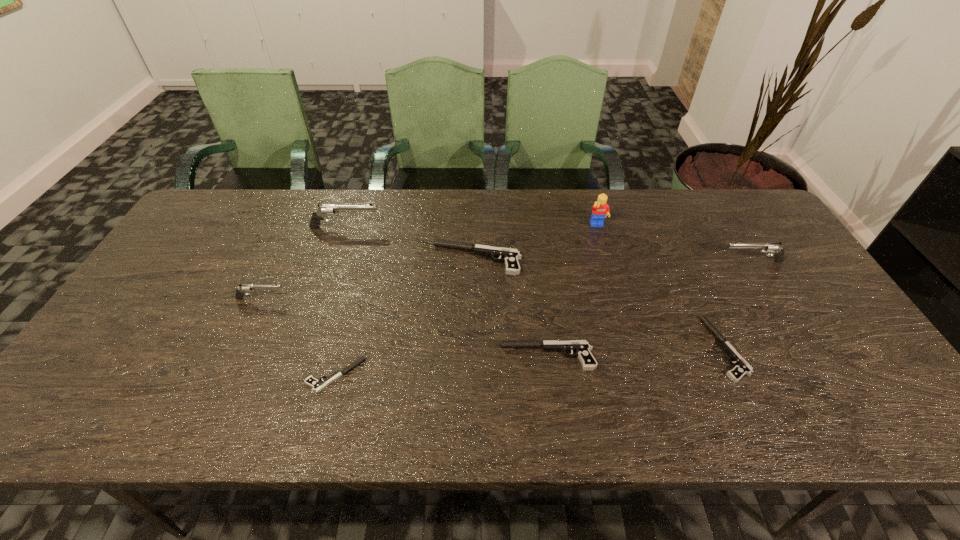
Image resolution: width=960 pixels, height=540 pixels. I want to click on free space located 0.250m on the front-facing side of the third tallest object, so click(636, 261).

Image resolution: width=960 pixels, height=540 pixels. Find the location of `free space located 0.200m on the front-facing side of the nearest silver pistol`. free space located 0.200m on the front-facing side of the nearest silver pistol is located at coordinates (361, 299).

At what (x,y) coordinates should I click in order to perform the action: click on free space located on the front-facing side of the fourth shortest pistol. Please return your answer as a coordinate pair (x, y). Looking at the image, I should click on (381, 259).

The width and height of the screenshot is (960, 540). Find the location of `free space located 0.150m on the front-facing side of the fourth shortest pistol`. free space located 0.150m on the front-facing side of the fourth shortest pistol is located at coordinates (381, 259).

I want to click on vacant space located on the front-facing side of the fourth shortest pistol, so click(297, 259).

Find the location of `vacant region located on the front-facing side of the third shortest object`. vacant region located on the front-facing side of the third shortest object is located at coordinates (388, 356).

At what (x,y) coordinates should I click in order to perform the action: click on free space located on the front-facing side of the third shortest object. Please return your answer as a coordinate pair (x, y). Looking at the image, I should click on [x=392, y=356].

The image size is (960, 540). I want to click on vacant area situated 0.060m on the front-facing side of the third shortest object, so click(x=475, y=356).

Identify the location of free space located 0.050m on the front-facing side of the second pistol from right to left. (691, 349).

You are a GUI agent. You are given a task and a screenshot of the screen. Output one action in this format:
    pyautogui.click(x=<x>, y=<y>)
    Task: Click on the vacant space located 0.260m on the front-facing side of the second pistol from right to left
    
    Given the screenshot: What is the action you would take?
    pyautogui.click(x=606, y=349)